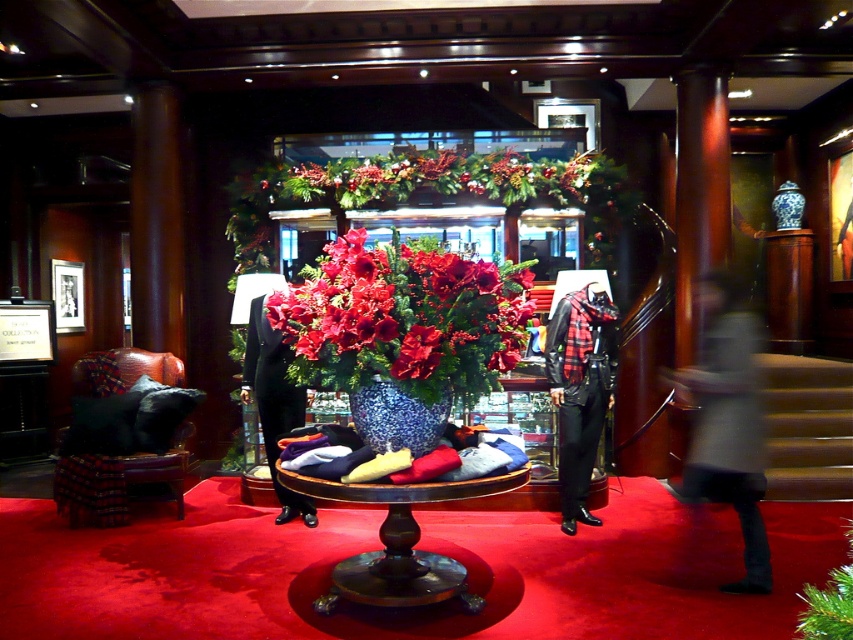
Between glossy ceramic vase at center and leather armchair at lower left, which one appears on the left side from the viewer's perspective?

leather armchair at lower left

Who is more forward, [288,324] or [170,458]?

Point [288,324] is in front.

This screenshot has width=853, height=640. In order to click on glossy ceramic vase at center in this screenshot , I will do `click(403, 317)`.

Which is behind, point (468, 348) or point (776, 381)?

The point (776, 381) is behind.

Between glossy ceramic vase at center and wooden stairs at right, which one has less height?

glossy ceramic vase at center is shorter.

Measure the distance between glossy ceramic vase at center and camera.

A distance of 8.71 feet exists between glossy ceramic vase at center and camera.

The height and width of the screenshot is (640, 853). I want to click on glossy ceramic vase at center, so click(403, 317).

Is leather armchair at lower left positioned before speckled ceramic vase at center?

No, it is not.

What do you see at coordinates (119, 483) in the screenshot? Image resolution: width=853 pixels, height=640 pixels. I see `leather armchair at lower left` at bounding box center [119, 483].

Does point (178, 499) come in front of point (366, 433)?

No, (178, 499) is behind (366, 433).

The width and height of the screenshot is (853, 640). I want to click on leather armchair at lower left, so click(119, 483).